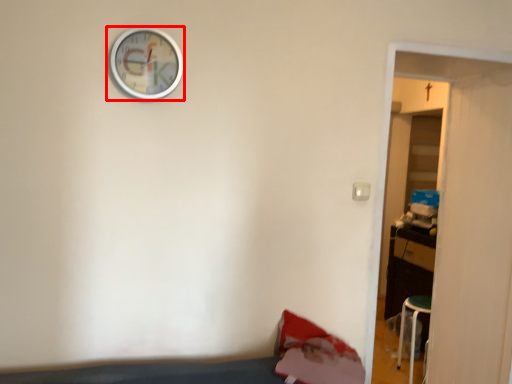
Question: From the image's perspective, where is wall clock (annotated by the red box) located relative to door?

Choices:
 (A) below
 (B) above

Answer: (B)